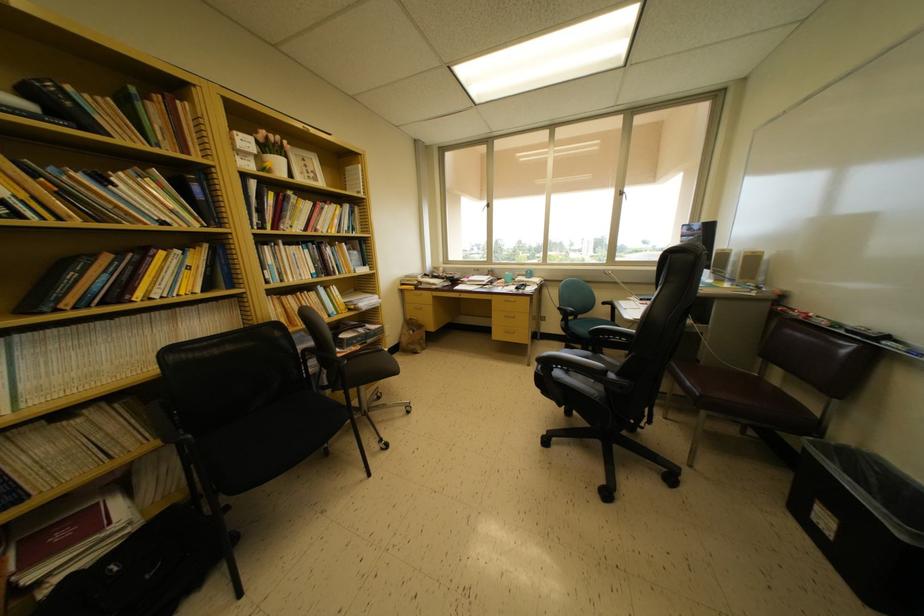
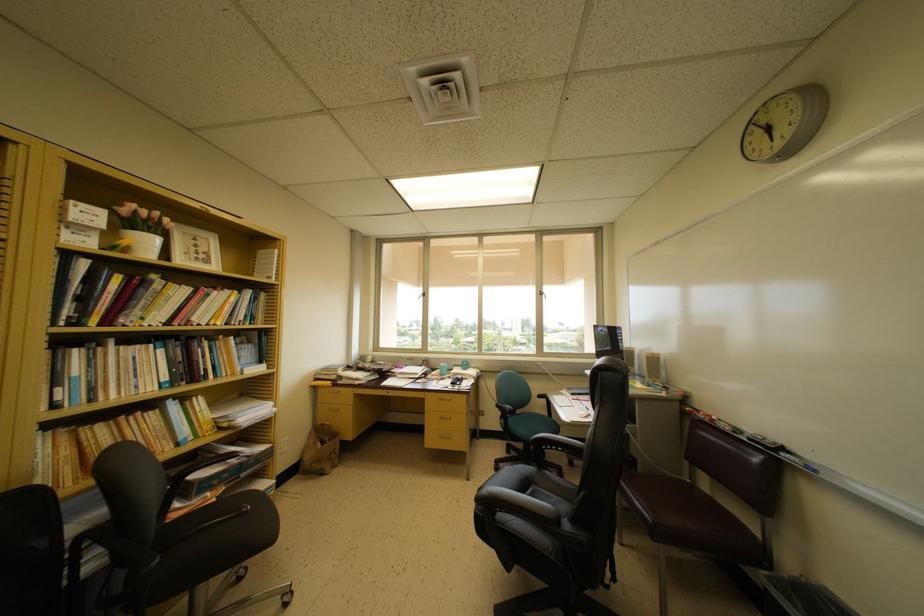
Question: Based on the continuous images, in which direction is the camera rotating? Reply with the corresponding letter.

Choices:
 (A) Left
 (B) Right
 (C) Up
 (D) Down

Answer: (C)